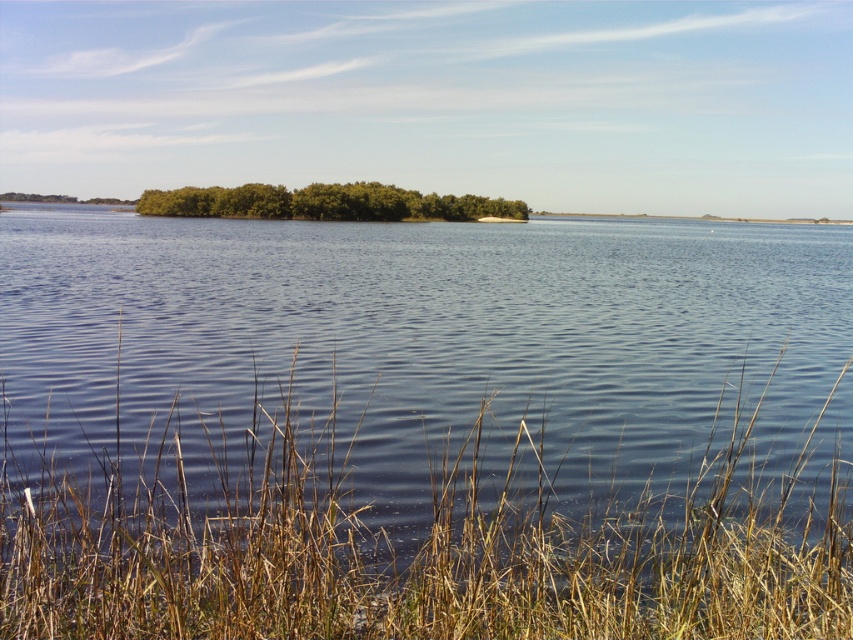
Does dry grass at lower center appear on the left side of green leafy trees at center?

In fact, dry grass at lower center is to the right of green leafy trees at center.

Is the position of dry grass at lower center less distant than that of green leafy trees at center?

That is True.

Between point (434, 480) and point (492, 209), which one is positioned in front?

Point (434, 480)

The image size is (853, 640). Find the location of `dry grass at lower center`. dry grass at lower center is located at coordinates (416, 547).